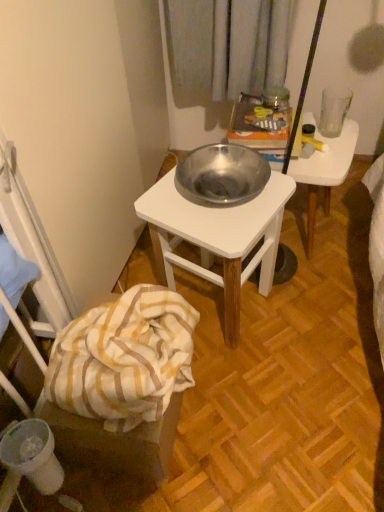
Question: Considering the relative sizes of yellow striped fabric at lower left and white striped fabric at lower left in the image provided, is yellow striped fabric at lower left shorter than white striped fabric at lower left?

Choices:
 (A) no
 (B) yes

Answer: (A)

Question: Is yellow striped fabric at lower left in front of white striped fabric at lower left?

Choices:
 (A) yes
 (B) no

Answer: (B)

Question: Is there a large distance between yellow striped fabric at lower left and white striped fabric at lower left?

Choices:
 (A) no
 (B) yes

Answer: (A)

Question: Does yellow striped fabric at lower left have a greater width compared to white striped fabric at lower left?

Choices:
 (A) yes
 (B) no

Answer: (B)

Question: From the image's perspective, is yellow striped fabric at lower left on white striped fabric at lower left?

Choices:
 (A) yes
 (B) no

Answer: (B)

Question: Does yellow striped fabric at lower left appear on the left side of white striped fabric at lower left?

Choices:
 (A) no
 (B) yes

Answer: (B)

Question: Can yellow striped fabric at lower left be found inside transparent glass at upper right?

Choices:
 (A) yes
 (B) no

Answer: (B)

Question: Is transparent glass at upper right further to the viewer compared to yellow striped fabric at lower left?

Choices:
 (A) yes
 (B) no

Answer: (A)

Question: Considering the relative positions of transparent glass at upper right and yellow striped fabric at lower left in the image provided, is transparent glass at upper right to the left of yellow striped fabric at lower left from the viewer's perspective?

Choices:
 (A) yes
 (B) no

Answer: (B)

Question: Can you confirm if transparent glass at upper right is smaller than yellow striped fabric at lower left?

Choices:
 (A) no
 (B) yes

Answer: (B)

Question: Does transparent glass at upper right appear on the right side of yellow striped fabric at lower left?

Choices:
 (A) no
 (B) yes

Answer: (B)

Question: Considering the relative sizes of transparent glass at upper right and yellow striped fabric at lower left in the image provided, is transparent glass at upper right taller than yellow striped fabric at lower left?

Choices:
 (A) yes
 (B) no

Answer: (B)

Question: Is yellow striped fabric at lower left taller than metallic silver bowl at center?

Choices:
 (A) no
 (B) yes

Answer: (A)